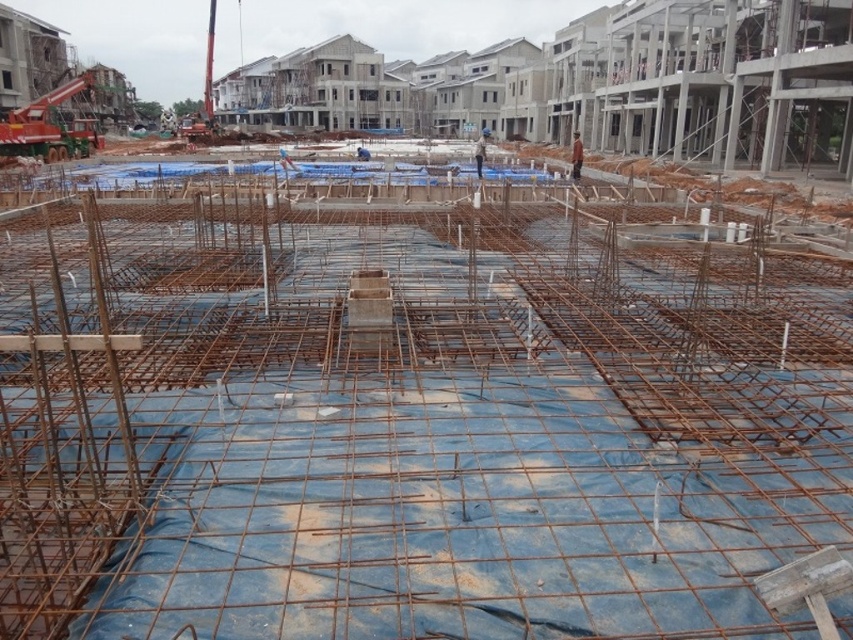
Question: Can you confirm if brown leather jacket at center is bigger than blue hard hat at center?

Choices:
 (A) no
 (B) yes

Answer: (A)

Question: Observing the image, what is the correct spatial positioning of brown leather jacket at center in reference to blue hard hat at center?

Choices:
 (A) above
 (B) below

Answer: (B)

Question: Which point is closer to the camera taking this photo?

Choices:
 (A) (476, 172)
 (B) (582, 157)

Answer: (A)

Question: Observing the image, what is the correct spatial positioning of brown leather jacket at center in reference to blue hard hat at center?

Choices:
 (A) below
 (B) above

Answer: (A)